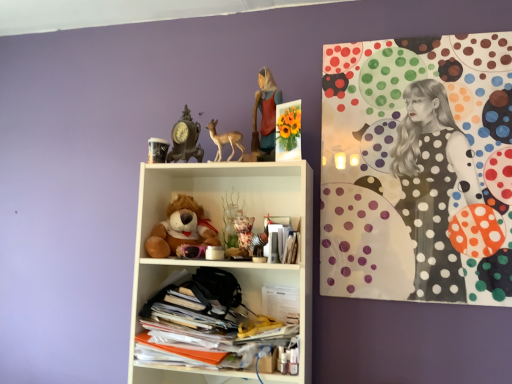
Question: Is antique clock at upper center oriented away from stacked papers at lower center, which ranks as the 1th shelf in bottom-to-top order?

Choices:
 (A) yes
 (B) no

Answer: (B)

Question: From a real-world perspective, is antique clock at upper center over stacked papers at lower center, which ranks as the 1th shelf in bottom-to-top order?

Choices:
 (A) yes
 (B) no

Answer: (A)

Question: Is antique clock at upper center oriented towards stacked papers at lower center, which ranks as the 1th shelf in bottom-to-top order?

Choices:
 (A) no
 (B) yes

Answer: (A)

Question: Considering the relative sizes of antique clock at upper center and stacked papers at lower center, marked as the second shelf in a top-to-bottom arrangement, in the image provided, is antique clock at upper center shorter than stacked papers at lower center, marked as the second shelf in a top-to-bottom arrangement,?

Choices:
 (A) yes
 (B) no

Answer: (A)

Question: Does antique clock at upper center lie behind stacked papers at lower center, which ranks as the 1th shelf in bottom-to-top order?

Choices:
 (A) yes
 (B) no

Answer: (A)

Question: Choose the correct answer: Is antique clock at upper center inside stacked papers at lower center, which ranks as the 1th shelf in bottom-to-top order, or outside it?

Choices:
 (A) inside
 (B) outside

Answer: (B)

Question: Is point coord(173,135) positioned closer to the camera than point coord(298,274)?

Choices:
 (A) closer
 (B) farther

Answer: (B)

Question: Relative to stacked papers at lower center, which ranks as the 1th shelf in bottom-to-top order, is antique clock at upper center in front or behind?

Choices:
 (A) behind
 (B) front

Answer: (A)

Question: From the image's perspective, is antique clock at upper center above or below stacked papers at lower center, marked as the second shelf in a top-to-bottom arrangement?

Choices:
 (A) above
 (B) below

Answer: (A)

Question: From the image's perspective, is polka dot fabric at upper right located above or below stacked papers at lower center, marked as the second shelf in a top-to-bottom arrangement?

Choices:
 (A) below
 (B) above

Answer: (B)

Question: Based on their sizes in the image, would you say polka dot fabric at upper right is bigger or smaller than stacked papers at lower center, which ranks as the 1th shelf in bottom-to-top order?

Choices:
 (A) big
 (B) small

Answer: (B)

Question: Is point (336, 129) closer or farther from the camera than point (245, 276)?

Choices:
 (A) closer
 (B) farther

Answer: (B)

Question: Choose the correct answer: Is polka dot fabric at upper right inside stacked papers at lower center, marked as the second shelf in a top-to-bottom arrangement, or outside it?

Choices:
 (A) inside
 (B) outside

Answer: (B)

Question: From a real-world perspective, is matte red dress at upper center positioned above or below stacked papers at lower center, marked as the second shelf in a top-to-bottom arrangement?

Choices:
 (A) above
 (B) below

Answer: (A)

Question: Is matte red dress at upper center spatially inside stacked papers at lower center, which ranks as the 1th shelf in bottom-to-top order, or outside of it?

Choices:
 (A) inside
 (B) outside

Answer: (B)